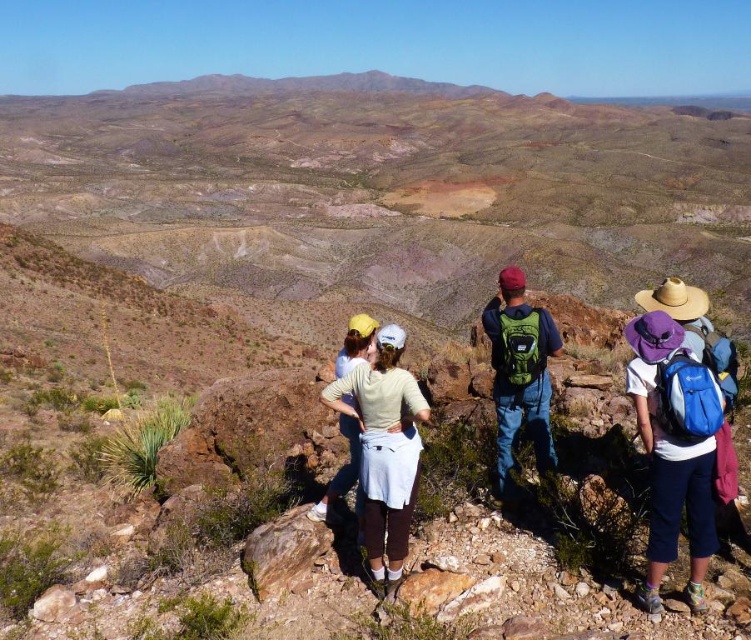
Is point (415, 484) positioned after point (540, 336)?

No.

In the scene shown: Who is more forward, (x=409, y=381) or (x=528, y=376)?

Point (x=409, y=381) is more forward.

Which is in front, point (394, 516) or point (547, 387)?

Point (394, 516) is in front.

Image resolution: width=751 pixels, height=640 pixels. Identify the location of white fabric skirt at center. (385, 449).

The height and width of the screenshot is (640, 751). In order to click on white fabric skirt at center in this screenshot , I will do `click(385, 449)`.

Can you confirm if green backpack at center is positioned to the left of light blue denim jeans at center?

In fact, green backpack at center is to the right of light blue denim jeans at center.

Based on the photo, does green backpack at center have a lesser height compared to light blue denim jeans at center?

Incorrect, green backpack at center's height does not fall short of light blue denim jeans at center's.

Where is `green backpack at center`? The height and width of the screenshot is (640, 751). green backpack at center is located at coordinates (520, 371).